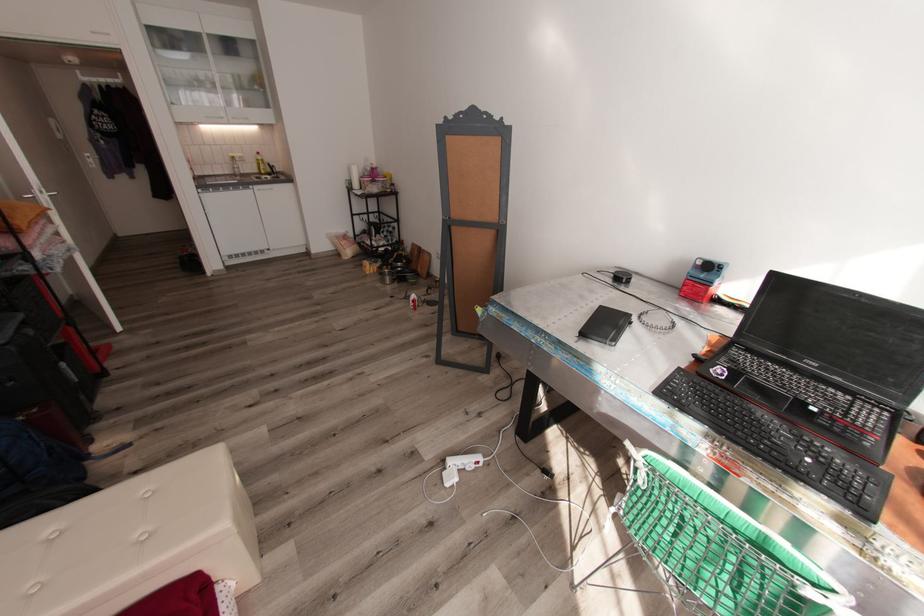
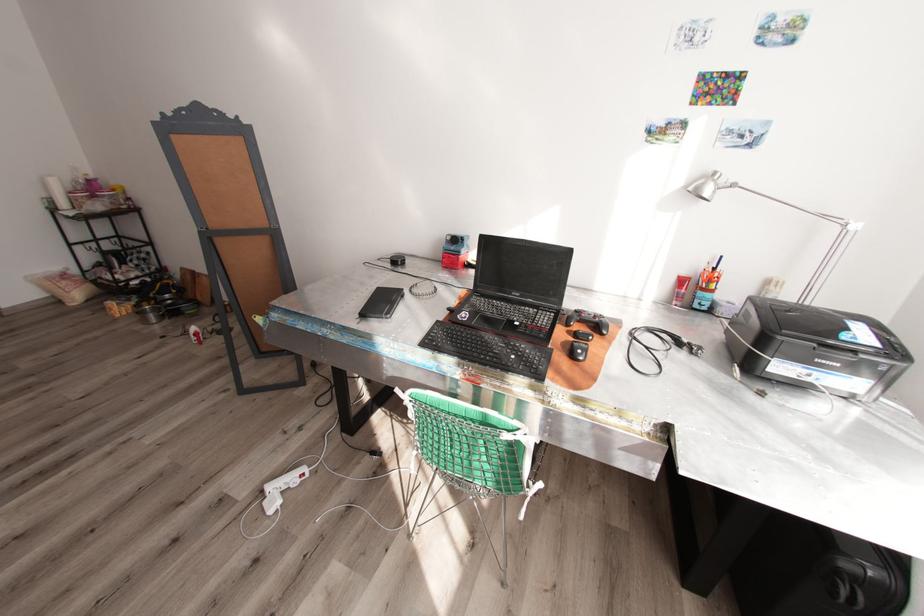
Find the pixel in the second image that matches (x=416, y=304) in the first image.

(199, 338)